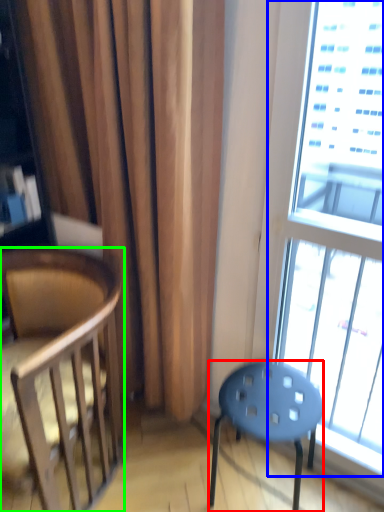
Question: Which object is positioned farthest from stool (highlighted by a red box)? Select from window (highlighted by a blue box) and chair (highlighted by a green box).

Choices:
 (A) window
 (B) chair

Answer: (A)